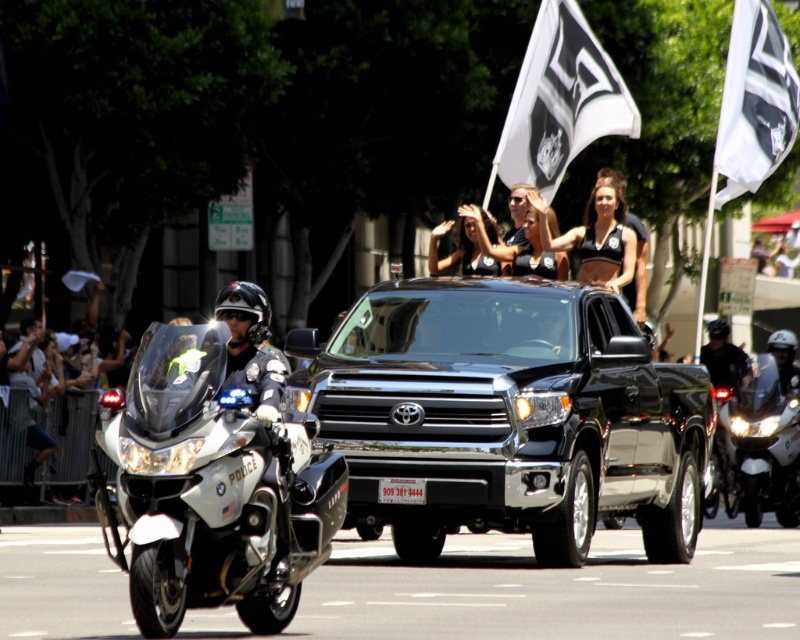
You are a pedestrian standing at the center of the street. You see a black metallic truck at center and a black fabric bikini top at center. Which object is closer to you?

Both the black metallic truck at center and the black fabric bikini top at center are at the same distance from you since they are both at the center of the street.

You are a photographer standing at the camera position. You want to capture a photo of the police officer on the white BMW motorcycle and the black Toyota pickup truck behind it. However, there is a specific point at coordinates point (494, 460) that you must avoid placing any objects in the frame. Given that the distance from the camera to this point is 88.67 feet, can you position yourself so that neither the motorcycle nor the truck is obstructed by this point?

The point at (494, 460) is 88.67 feet away from the camera. Since both the police officer on the white BMW motorcycle and the black Toyota pickup truck are positioned in the foreground and behind it respectively, their distances from the camera would be different. To ensure neither is obstructed by the point, you need to adjust your position so that the motorcycle and truck are not aligned with the point at that specific distance. However, without knowing the exact distances of the motorcycle and truck, a

You are a drone operator trying to capture aerial footage of the street parade. Your drone has a maximum flight range of 5 meters. You need to film both the black fabric flag at upper center and the black fabric bikini top at center. Can your drone stay within range to film both objects without moving its starting position?

A: The distance between the black fabric flag at upper center and the black fabric bikini top at center is 6.70 meters. Since the drone can only fly up to 5 meters, it cannot stay within range to film both objects without moving its starting position.